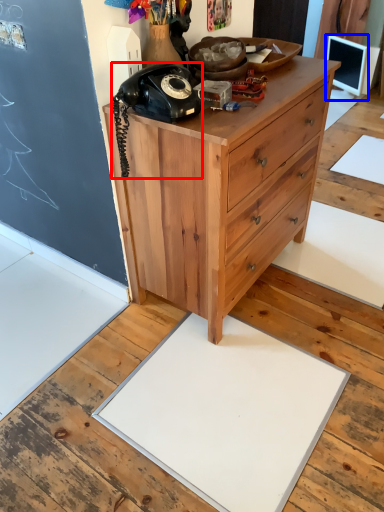
Question: Which object is closer to the camera taking this photo, corded phone (highlighted by a red box) or computer monitor (highlighted by a blue box)?

Choices:
 (A) corded phone
 (B) computer monitor

Answer: (A)